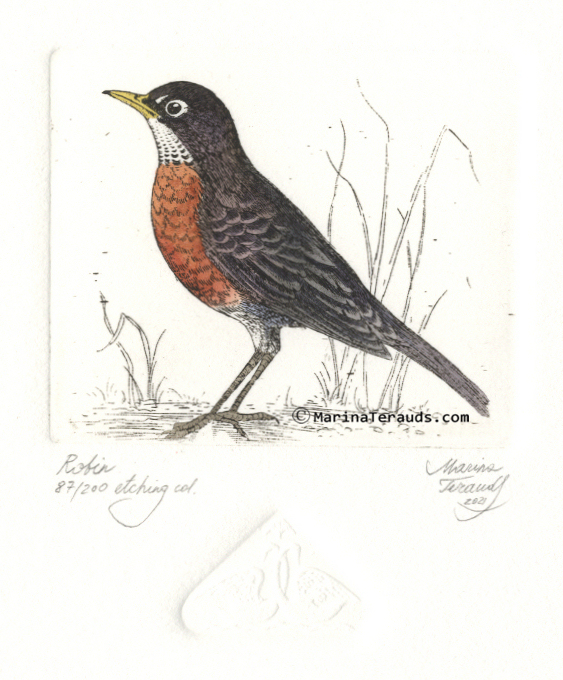
Where is `artwork`? The width and height of the screenshot is (563, 680). artwork is located at coordinates (251, 222).